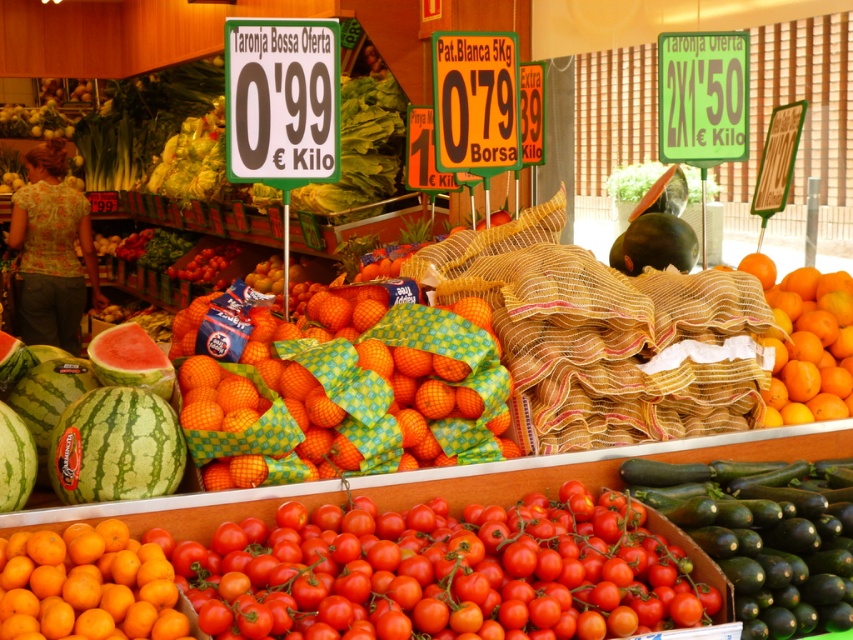
Between orange matte at center and green plastic sign at upper center, which one appears on the right side from the viewer's perspective?

From the viewer's perspective, green plastic sign at upper center appears more on the right side.

Who is more forward, (x=146, y=598) or (x=267, y=116)?

Positioned in front is point (x=146, y=598).

Where is `orange matte at center`? The height and width of the screenshot is (640, 853). orange matte at center is located at coordinates 86,586.

Who is taller, glossy red tomato at center or orange matte at center?

With more height is glossy red tomato at center.

Describe the element at coordinates (442, 572) in the screenshot. This screenshot has width=853, height=640. I see `glossy red tomato at center` at that location.

Who is more distant from viewer, (361, 628) or (160, 570)?

Positioned behind is point (160, 570).

Where is `glossy red tomato at center`? glossy red tomato at center is located at coordinates (442, 572).

Is glossy red tomato at center bigger than green striped watermelon at lower left?

Yes, glossy red tomato at center is bigger than green striped watermelon at lower left.

Between point (399, 570) and point (138, 417), which one is positioned in front?

Point (399, 570) is more forward.

Who is more forward, (387, 580) or (109, 449)?

Positioned in front is point (387, 580).

I want to click on glossy red tomato at center, so click(442, 572).